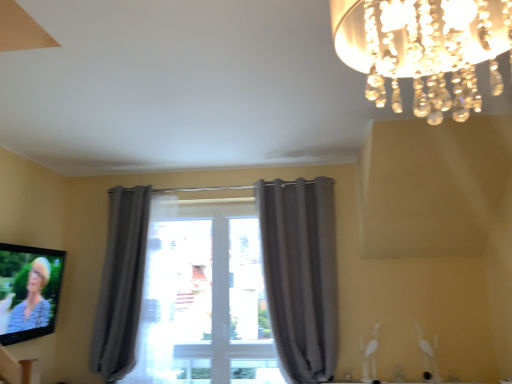
Question: Looking at their shapes, would you say matte black tv at lower left is wider or thinner than gray fabric curtain at center, the first curtain viewed from the right?

Choices:
 (A) wide
 (B) thin

Answer: (B)

Question: Does point (26, 322) appear closer or farther from the camera than point (287, 279)?

Choices:
 (A) closer
 (B) farther

Answer: (A)

Question: Estimate the real-world distances between objects in this image. Which object is farther from the matte black tv at lower left?

Choices:
 (A) gray fabric curtain at center, the first curtain viewed from the right
 (B) clear crystal chandelier at upper right
 (C) gray fabric curtain at left, the second curtain viewed from the right

Answer: (B)

Question: Estimate the real-world distances between objects in this image. Which object is farther from the gray fabric curtain at center, the first curtain viewed from the right?

Choices:
 (A) matte black tv at lower left
 (B) clear crystal chandelier at upper right
 (C) gray fabric curtain at left, the second curtain viewed from the right

Answer: (B)